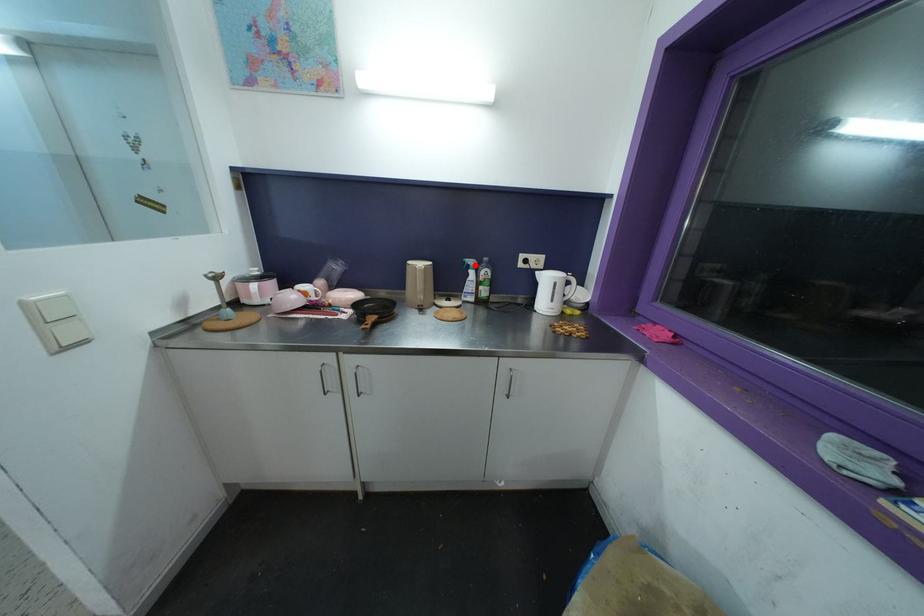
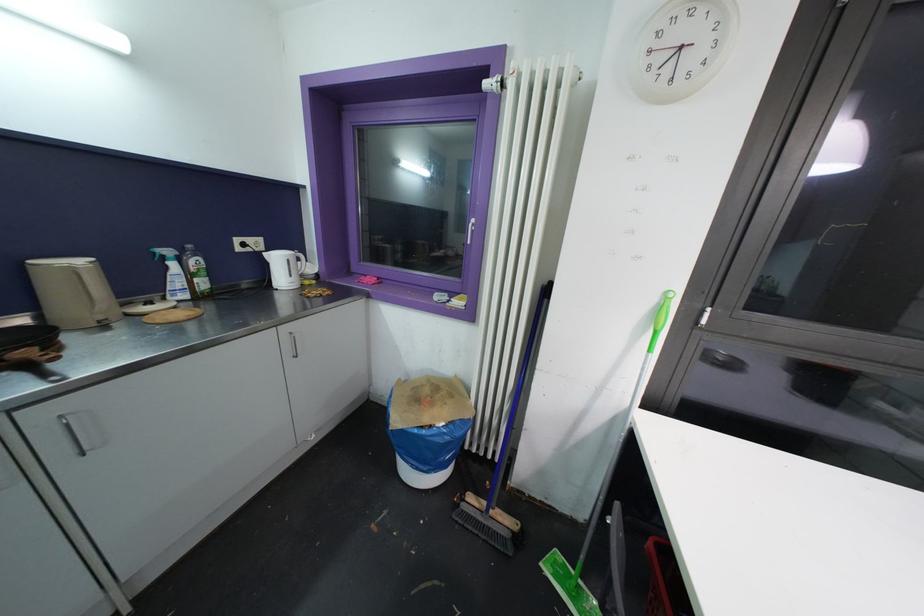
In the second image, find the point that corresponds to the highlighted location in the first image.

(171, 254)